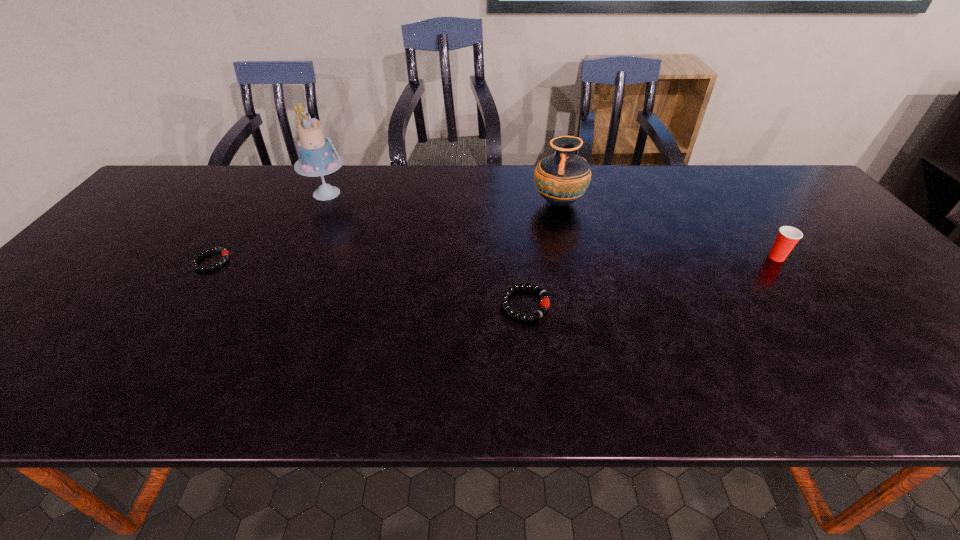
Locate an element on the screen. This screenshot has width=960, height=540. vacant space located 0.160m on the front of the fourth shortest object is located at coordinates (570, 255).

Locate an element on the screen. free location located on the right of the Dixie cup is located at coordinates (849, 258).

Find the location of a particular element. Image resolution: width=960 pixels, height=540 pixels. vacant point located 0.350m on the back of the second shortest object is located at coordinates (515, 204).

This screenshot has width=960, height=540. Find the location of `free space located on the front of the farther bracelet`. free space located on the front of the farther bracelet is located at coordinates (180, 308).

Where is `cake located in the far edge section of the desktop`? cake located in the far edge section of the desktop is located at coordinates (317, 158).

Locate an element on the screen. The height and width of the screenshot is (540, 960). pottery that is positioned at the far edge is located at coordinates (561, 179).

You are a GUI agent. You are given a task and a screenshot of the screen. Output one action in this format:
    pyautogui.click(x=<x>, y=<y>)
    Task: Click on the free location at the far edge of the desktop
    The height and width of the screenshot is (540, 960).
    Given the screenshot: What is the action you would take?
    pyautogui.click(x=357, y=170)

Where is `free location at the near edge`? free location at the near edge is located at coordinates (360, 381).

Locate an element on the screen. The image size is (960, 540). vacant space at the left edge of the desktop is located at coordinates [144, 245].

This screenshot has height=540, width=960. Find the location of `vacant area at the right edge`. vacant area at the right edge is located at coordinates (819, 215).